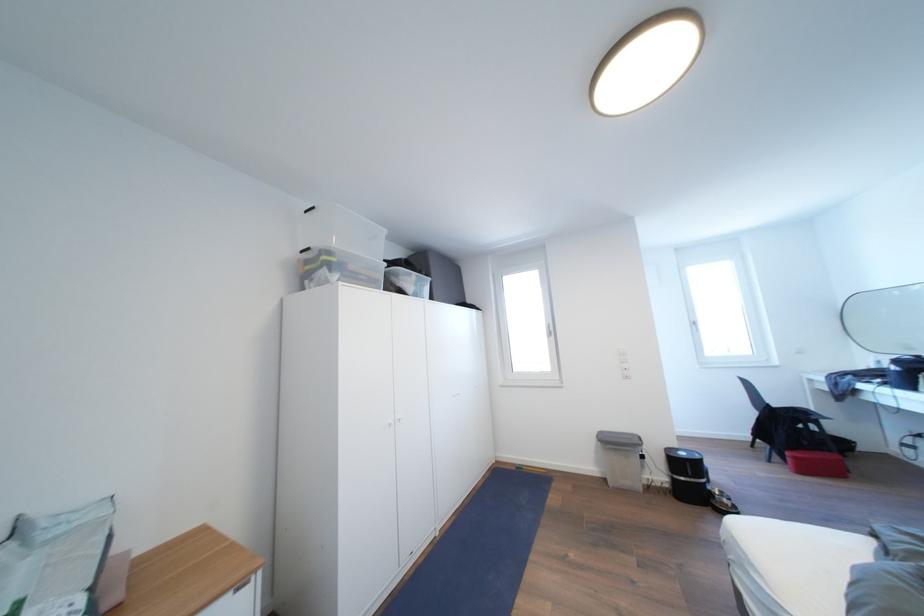
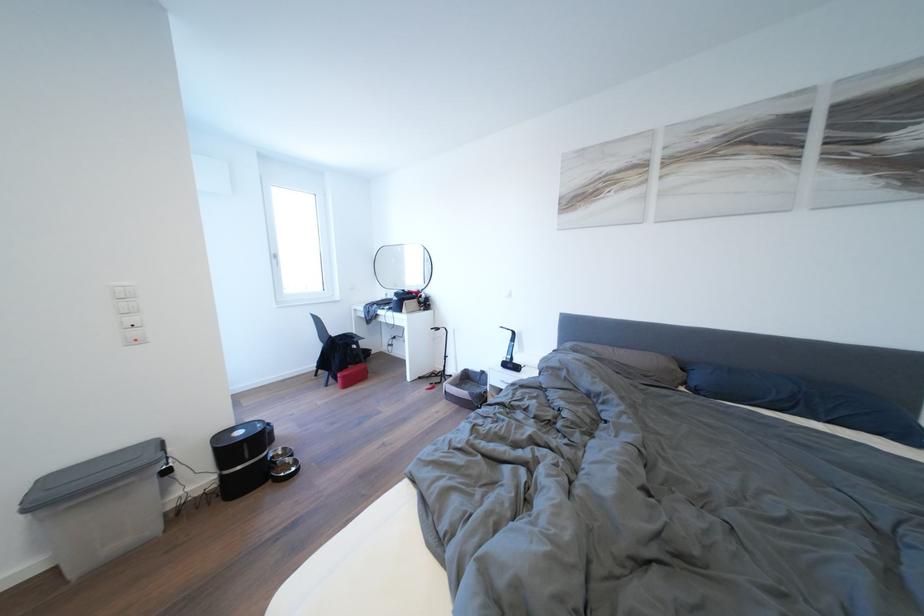
Find the pixel in the second image that matches pixel 689 459 in the first image.

(248, 438)